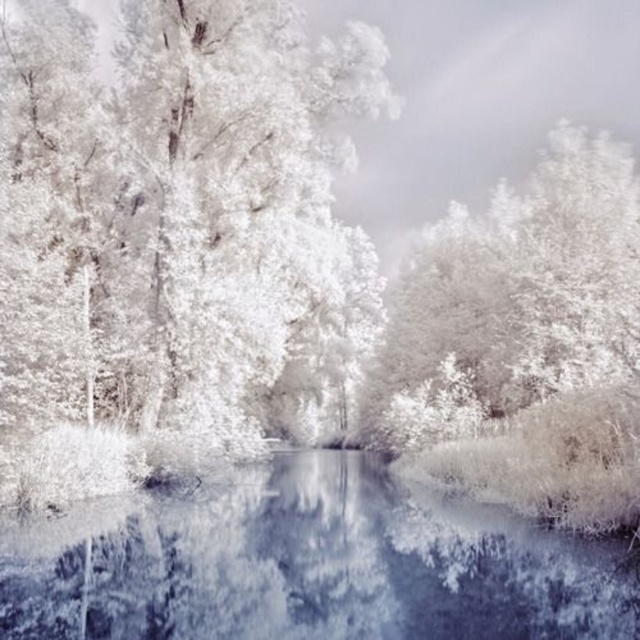
You are an ice skater standing on the translucent ice at center. Looking towards the white frosty tree at left, can you see the tree reflected in the water behind you?

The translucent ice at center is behind the white frosty tree at left, so when standing on the translucent ice at center and facing the white frosty tree at left, the water behind you would reflect the scene behind the translucent ice at center, which does not include the white frosty tree at left. Therefore, you cannot see the tree reflected in the water behind you.

You are standing at the origin point of the coordinate system where the image is displayed. The origin is at the bottom left corner of the image. The coordinates are given in normalized units between 0 and 1. You want to walk towards the white frosty tree at left. In which direction should you move from the origin?

Since the white frosty tree at left is located at coordinates point (176, 240), you should move towards the upper right direction from the origin to reach it.